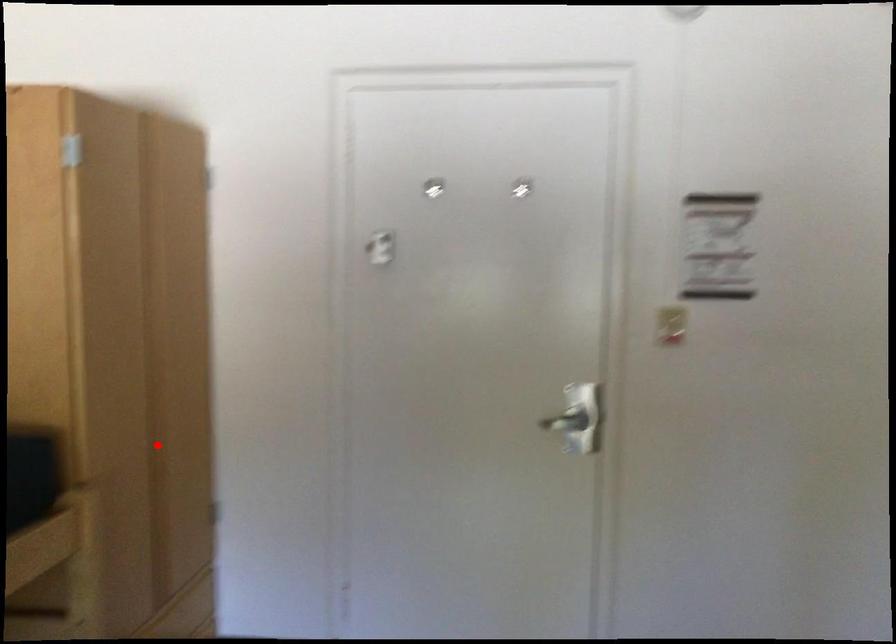
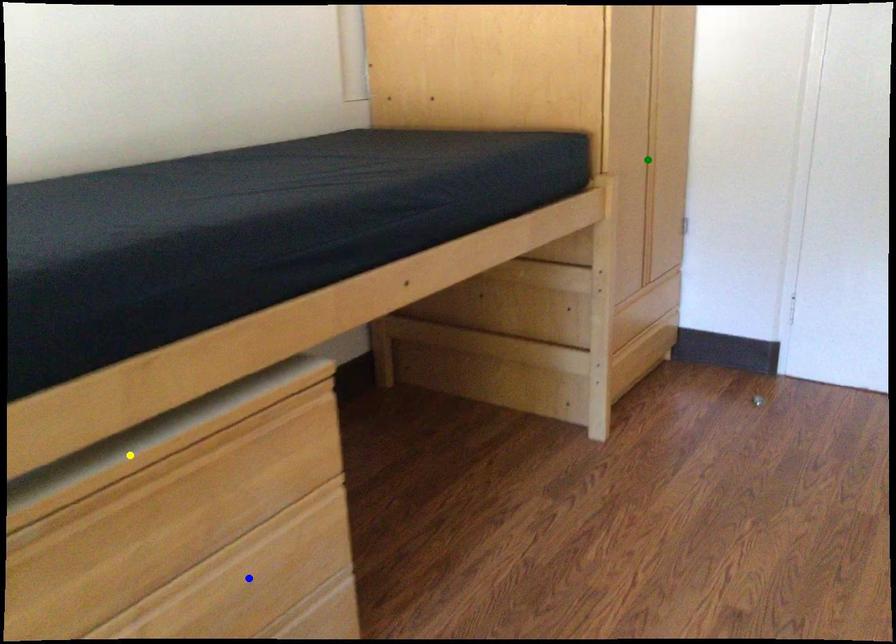
Question: I am providing you with two images of the same scene from different viewpoints. A red point is marked on the first image. You are given multiple points on the second image. Which spot in image 2 lines up with the point in image 1?

Choices:
 (A) yellow point
 (B) green point
 (C) blue point

Answer: (B)